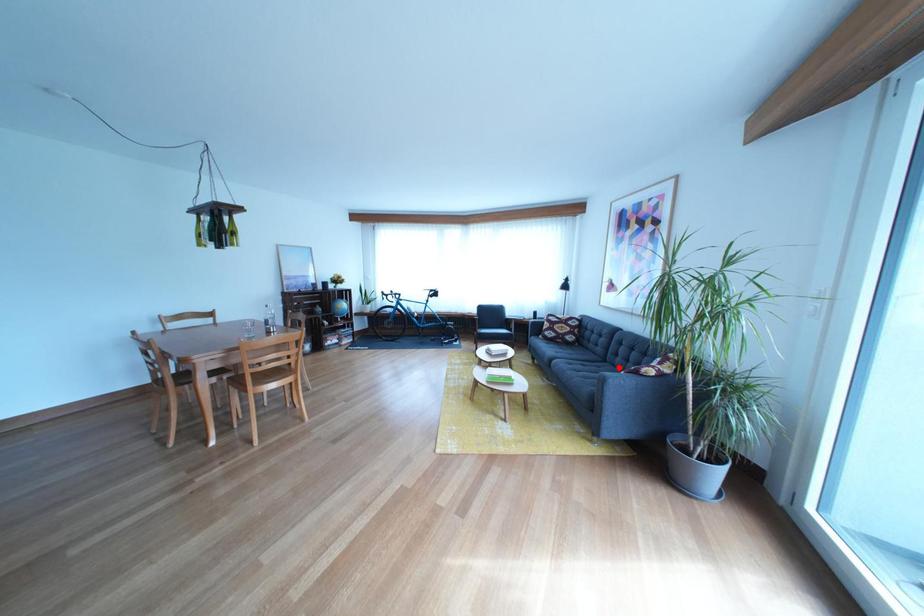
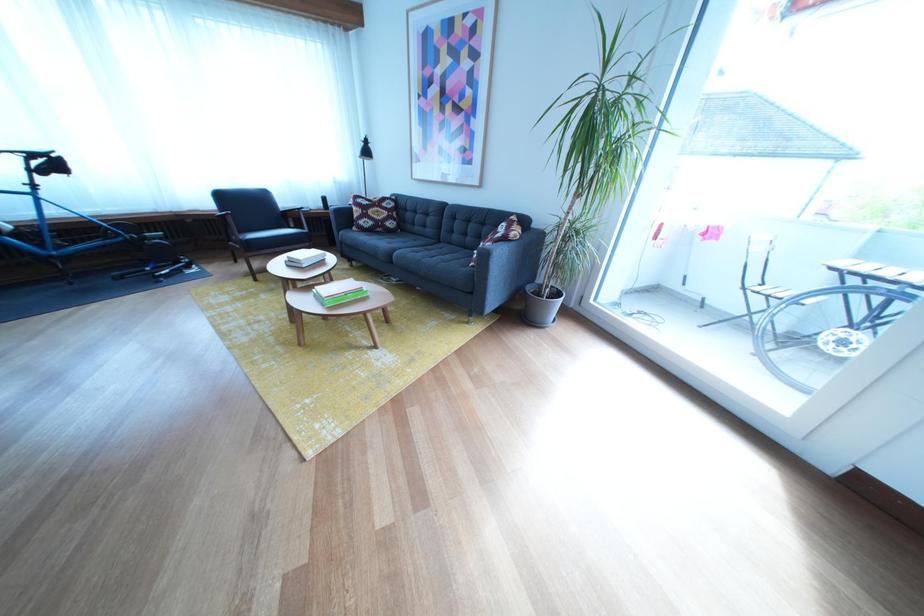
In the second image, find the point that corresponds to the highlighted location in the first image.

(453, 248)